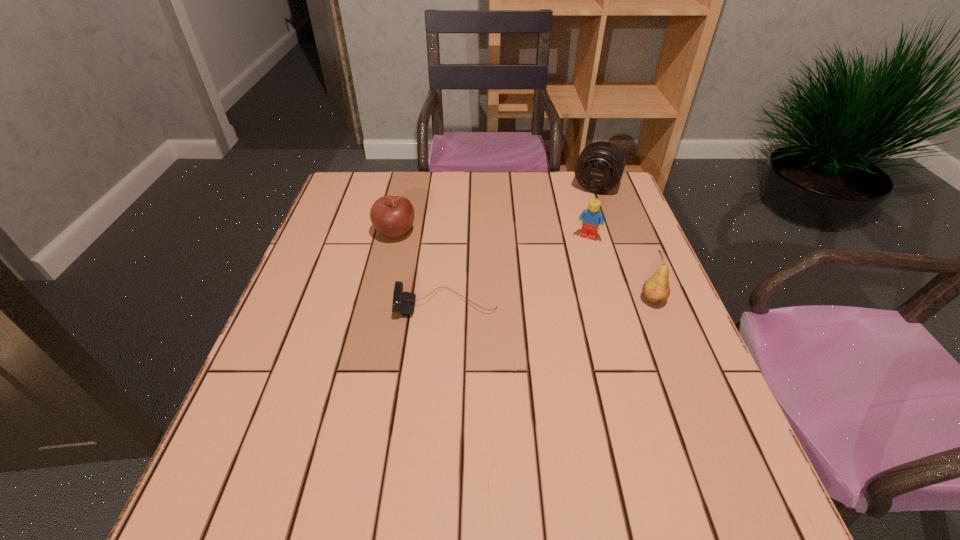
Where is `pear situated at the right edge`? pear situated at the right edge is located at coordinates (656, 290).

Identify the location of telephoto lens that is at the right edge. The image size is (960, 540). (600, 166).

Find the location of a particular element. The height and width of the screenshot is (540, 960). Lego located at the right edge is located at coordinates (592, 217).

Identify the location of object that is at the far right corner. (600, 166).

Where is `blank space at the far edge of the desktop`? The width and height of the screenshot is (960, 540). blank space at the far edge of the desktop is located at coordinates (516, 207).

Where is `free region at the near edge`? The width and height of the screenshot is (960, 540). free region at the near edge is located at coordinates (400, 449).

This screenshot has width=960, height=540. What are the coordinates of `free space at the left edge of the desktop` in the screenshot? It's located at (362, 231).

What are the coordinates of `vacant point at the right edge` in the screenshot? It's located at (613, 289).

Where is `vacant position at the far left corner of the desktop`? This screenshot has height=540, width=960. vacant position at the far left corner of the desktop is located at coordinates (372, 181).

Find the location of a particular element. This screenshot has height=540, width=960. free space at the far right corner of the desktop is located at coordinates coord(608,193).